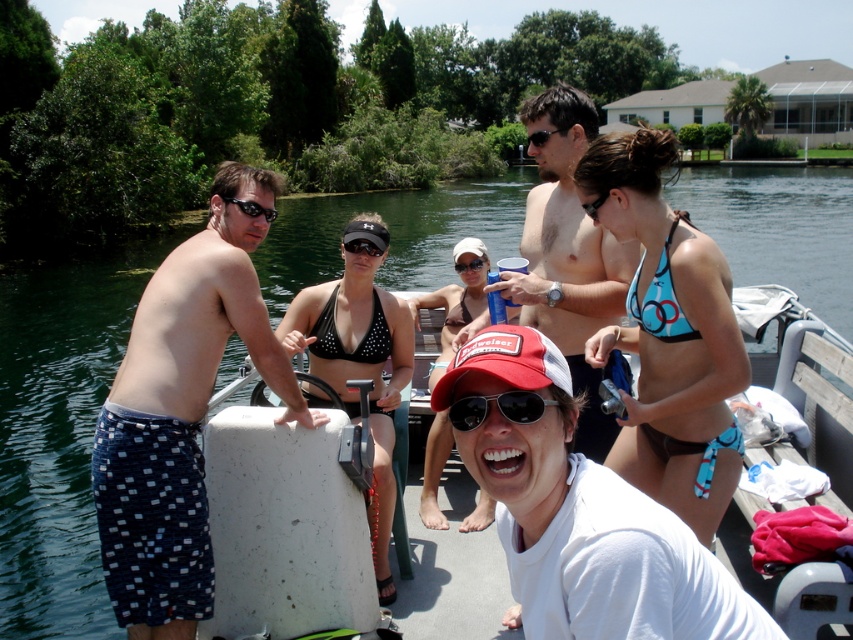
Question: Considering the relative positions of matte black swim trunks at center and black plastic sunglasses at left in the image provided, where is matte black swim trunks at center located with respect to black plastic sunglasses at left?

Choices:
 (A) below
 (B) above

Answer: (B)

Question: Can you confirm if black dotted bikini at upper center is thinner than black textured goggles at center?

Choices:
 (A) no
 (B) yes

Answer: (A)

Question: Which is farther from the clear water at center?

Choices:
 (A) black rubber goggles at center
 (B) black textured goggles at center

Answer: (A)

Question: Is clear water at center smaller than sunglassestransparent at center?

Choices:
 (A) no
 (B) yes

Answer: (A)

Question: Considering the real-world distances, which object is closest to the transparent plastic goggles at center?

Choices:
 (A) black bikini top at center
 (B) clear water at center
 (C) blue printed bikini at upper right

Answer: (A)

Question: Which point is farther from the camera taking this photo?

Choices:
 (A) (428, 374)
 (B) (247, 208)
 (C) (477, 422)
 (D) (602, 198)

Answer: (A)